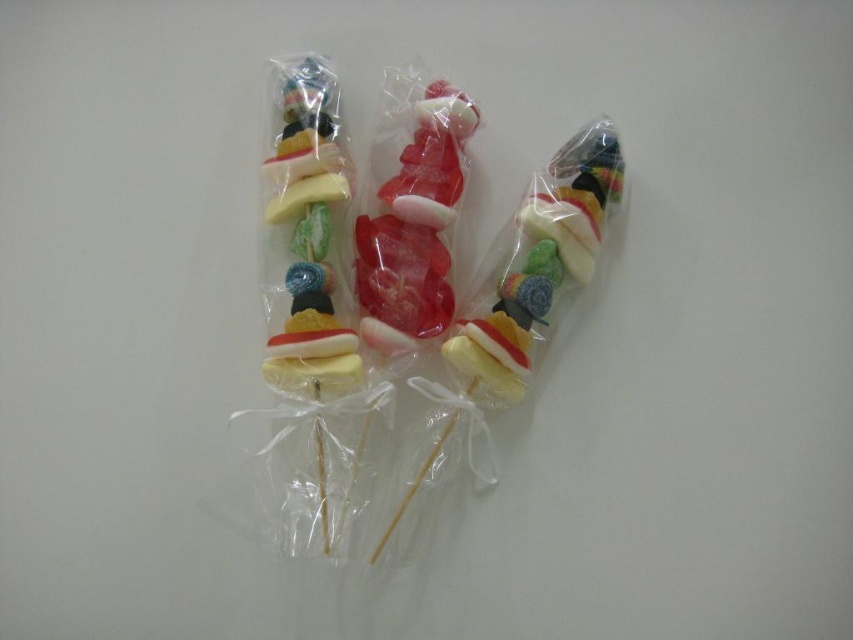
You are standing 5 feet away from the lollipops displayed in the image. There is a specific point at coordinates point (432, 196). Can you reach that point without moving closer than 4.5 feet to the lollipops?

The distance of point (432, 196) from the camera is 4.53 feet. Since you are standing 5 feet away, you can reach the point as it is within your reach range without moving closer than 4.5 feet.

Consider the image. You are holding a camera and want to take a closeup shot of the translucent plastic lollipops at center. The camera requires the subject to be at least 4 feet away to focus properly. Can you take the photo without moving the lollipops?

The translucent plastic lollipops at center is 4.30 feet away from camera, so yes, you can take the photo without moving the lollipops because the distance meets the camera requirement.

You are a photographer trying to capture the lollipop arrangement. You want to focus on the point at point (x=305, y=474) and point (x=618, y=145). Which point should you adjust your camera focus to first to ensure it is in sharp focus?

Point (x=305, y=474) is closer to the camera than point (x=618, y=145), so you should focus on point (x=305, y=474) first to ensure it is in sharp focus before adjusting for the other point.